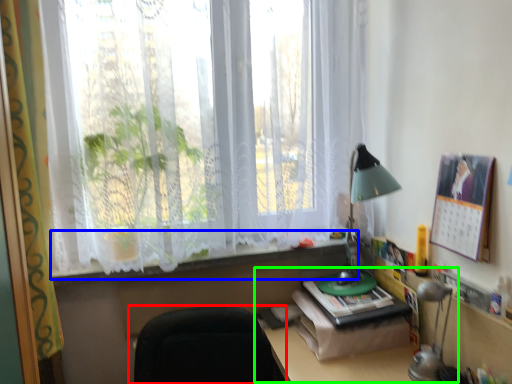
Question: Estimate the real-world distances between objects in this image. Which object is farther from chair (highlighted by a red box), window sill (highlighted by a blue box) or computer desk (highlighted by a green box)?

Choices:
 (A) window sill
 (B) computer desk

Answer: (A)